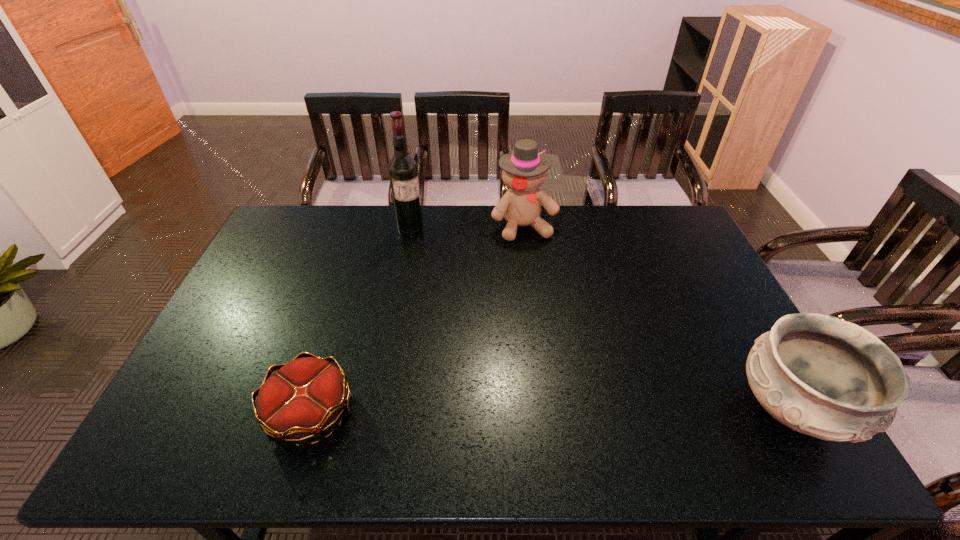
Where is `the shortest object`? The image size is (960, 540). the shortest object is located at coordinates (302, 400).

This screenshot has height=540, width=960. I want to click on the leftmost object, so click(302, 400).

Find the location of a particular element. The image size is (960, 540). the rightmost object is located at coordinates (821, 376).

This screenshot has height=540, width=960. Find the location of `the third tallest object`. the third tallest object is located at coordinates (821, 376).

At what (x,y) coordinates should I click in order to perform the action: click on wine bottle. Please return your answer as a coordinate pair (x, y). Looking at the image, I should click on (403, 173).

This screenshot has width=960, height=540. Identify the location of the tallest object. (403, 173).

Find the location of a particular element. Image resolution: width=960 pixels, height=540 pixels. the second object from right to left is located at coordinates (524, 171).

Where is `the third shortest object`? The image size is (960, 540). the third shortest object is located at coordinates (524, 171).

Locate an element on the screen. This screenshot has height=540, width=960. vacant area situated 0.100m on the right of the crown is located at coordinates (395, 414).

Where is `free spot located 0.050m on the left of the third tallest object`? The image size is (960, 540). free spot located 0.050m on the left of the third tallest object is located at coordinates (713, 409).